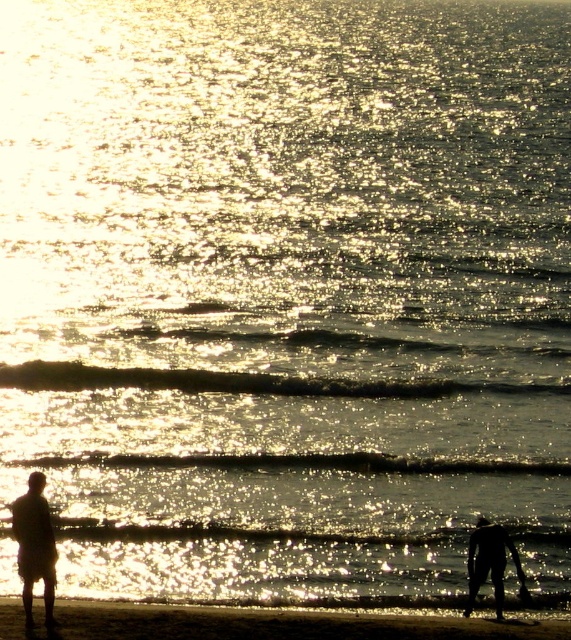
Is point (488, 627) positioned before point (489, 522)?

Yes.

Is sandy beach at lower center smaller than black matte figure at lower right?

Yes, sandy beach at lower center is smaller than black matte figure at lower right.

Between point (19, 632) and point (477, 556), which one is positioned behind?

Point (477, 556)

Locate an element on the screen. The width and height of the screenshot is (571, 640). sandy beach at lower center is located at coordinates (280, 624).

Who is taller, sandy beach at lower center or silhouette figure at left?

silhouette figure at left

Consider the image. Between sandy beach at lower center and silhouette figure at left, which one is positioned higher?

silhouette figure at left is above.

You are a GUI agent. You are given a task and a screenshot of the screen. Output one action in this format:
    pyautogui.click(x=<x>, y=<y>)
    Task: Click on the sandy beach at lower center
    This screenshot has width=571, height=640.
    Given the screenshot: What is the action you would take?
    (x=280, y=624)

I want to click on sandy beach at lower center, so click(x=280, y=624).

Does silhouette figure at left appear on the left side of black matte figure at lower right?

Correct, you'll find silhouette figure at left to the left of black matte figure at lower right.

Can you confirm if silhouette figure at left is bigger than black matte figure at lower right?

Incorrect, silhouette figure at left is not larger than black matte figure at lower right.

Does point (23, 512) come behind point (516, 548)?

That is False.

Image resolution: width=571 pixels, height=640 pixels. I want to click on silhouette figure at left, so click(34, 548).